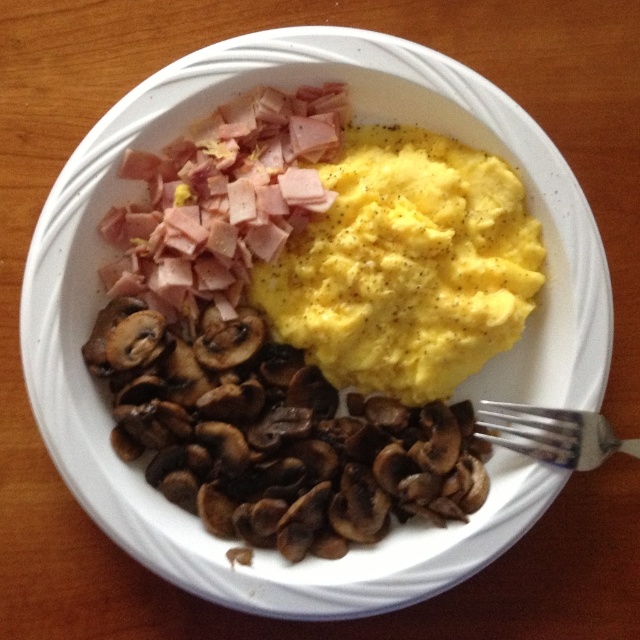
Does yellow matte egg at center have a smaller size compared to silver metallic fork at lower right?

Incorrect, yellow matte egg at center is not smaller in size than silver metallic fork at lower right.

Where is `yellow matte egg at center`? yellow matte egg at center is located at coordinates (406, 266).

Between point (502, 196) and point (564, 435), which one is positioned in front?

Point (564, 435)

Identify the location of yellow matte egg at center. (406, 266).

Who is positioned more to the left, brown glossy mushrooms at left or yellow matte egg at center?

brown glossy mushrooms at left

Can you confirm if brown glossy mushrooms at left is positioned to the left of yellow matte egg at center?

Indeed, brown glossy mushrooms at left is positioned on the left side of yellow matte egg at center.

This screenshot has height=640, width=640. In order to click on brown glossy mushrooms at left in this screenshot , I will do `click(308, 317)`.

Looking at this image, which of these two, brown glossy mushrooms at left or silver metallic fork at lower right, stands taller?

brown glossy mushrooms at left is taller.

Can you confirm if brown glossy mushrooms at left is smaller than silver metallic fork at lower right?

Actually, brown glossy mushrooms at left might be larger than silver metallic fork at lower right.

Where is `brown glossy mushrooms at left`? brown glossy mushrooms at left is located at coordinates (308, 317).